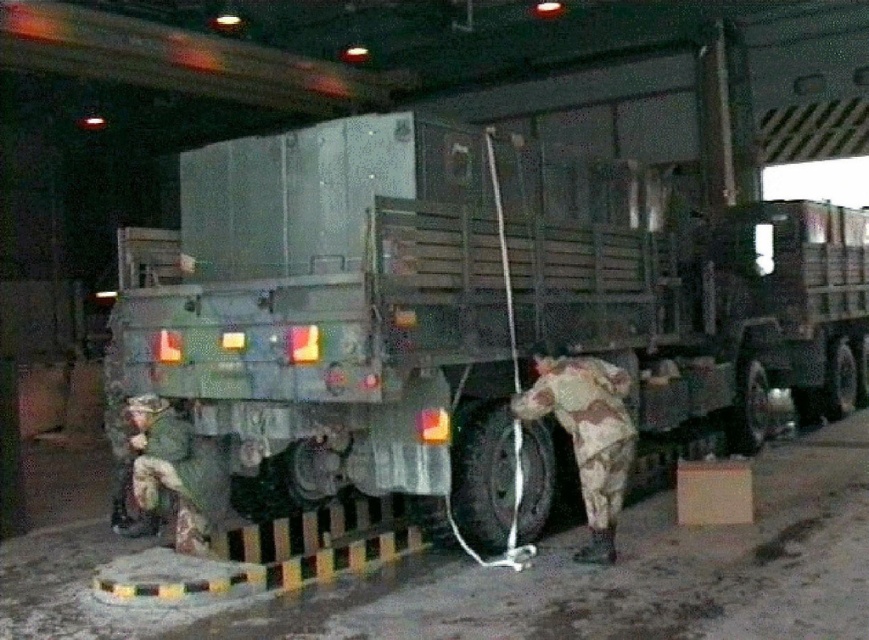
You are a photographer trying to capture a wide shot of the green matte trailer truck at center and the camouflage fabric soldier at lower right. Given that the truck is wider than the soldier, how should you position your camera to ensure both subjects are fully in frame?

Since the green matte trailer truck at center is wider than the camouflage fabric soldier at lower right, position the camera closer to the truck to accommodate its greater width while still capturing the soldier in the frame.

You are planning to move the green matte trailer truck at center through a narrow doorway. The doorway is just wide enough for the camouflage fabric soldier at lower left to pass through sideways. Can the truck fit through the doorway?

The green matte trailer truck at center might be wider than camouflage fabric soldier at lower left, so it might not fit through the doorway if the doorway is only wide enough for the soldier to pass sideways.

From the picture: You are standing in the hangar and see the point marked at coordinates (332, 317). Based on the scene description, can you determine what object this point is located on?

The point at coordinates (332, 317) is located on the green matte trailer truck at center.